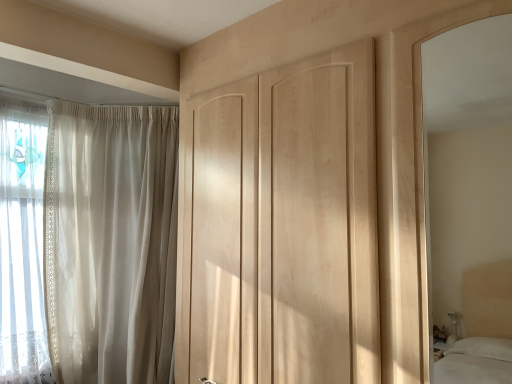
Question: Is there a large distance between light wood/matte mirror at right and natural wood door at center?

Choices:
 (A) no
 (B) yes

Answer: (B)

Question: Can you confirm if light wood/matte mirror at right is shorter than natural wood door at center?

Choices:
 (A) yes
 (B) no

Answer: (A)

Question: Is light wood/matte mirror at right aimed at natural wood door at center?

Choices:
 (A) no
 (B) yes

Answer: (A)

Question: From the image's perspective, is light wood/matte mirror at right below natural wood door at center?

Choices:
 (A) yes
 (B) no

Answer: (B)

Question: From a real-world perspective, is light wood/matte mirror at right located higher than natural wood door at center?

Choices:
 (A) yes
 (B) no

Answer: (A)

Question: Does point (466, 258) appear closer or farther from the camera than point (112, 135)?

Choices:
 (A) closer
 (B) farther

Answer: (B)

Question: In terms of height, does light wood/matte mirror at right look taller or shorter compared to sheer white curtain at left?

Choices:
 (A) tall
 (B) short

Answer: (B)

Question: In terms of width, does light wood/matte mirror at right look wider or thinner when compared to sheer white curtain at left?

Choices:
 (A) thin
 (B) wide

Answer: (A)

Question: From the image's perspective, relative to sheer white curtain at left, is light wood/matte mirror at right above or below?

Choices:
 (A) below
 (B) above

Answer: (B)

Question: Does point (76, 114) appear closer or farther from the camera than point (195, 253)?

Choices:
 (A) closer
 (B) farther

Answer: (B)

Question: Is sheer white curtain at left bigger or smaller than natural wood door at center?

Choices:
 (A) small
 (B) big

Answer: (B)

Question: In terms of height, does sheer white curtain at left look taller or shorter compared to natural wood door at center?

Choices:
 (A) short
 (B) tall

Answer: (B)

Question: From a real-world perspective, relative to natural wood door at center, is sheer white curtain at left vertically above or below?

Choices:
 (A) above
 (B) below

Answer: (B)

Question: Is sheer white curtain at left inside the boundaries of light wood/matte mirror at right, or outside?

Choices:
 (A) inside
 (B) outside

Answer: (B)

Question: From the image's perspective, relative to light wood/matte mirror at right, is sheer white curtain at left above or below?

Choices:
 (A) above
 (B) below

Answer: (B)